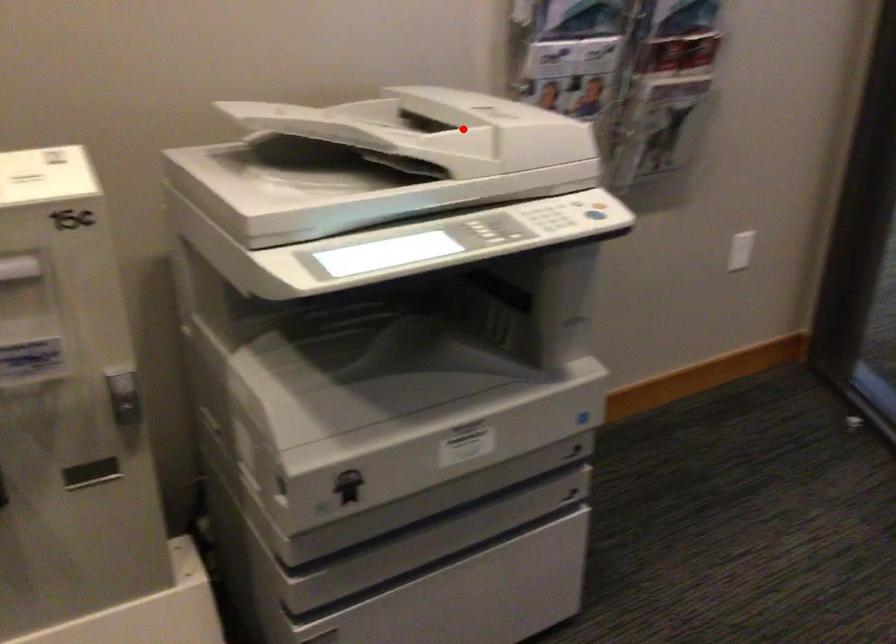
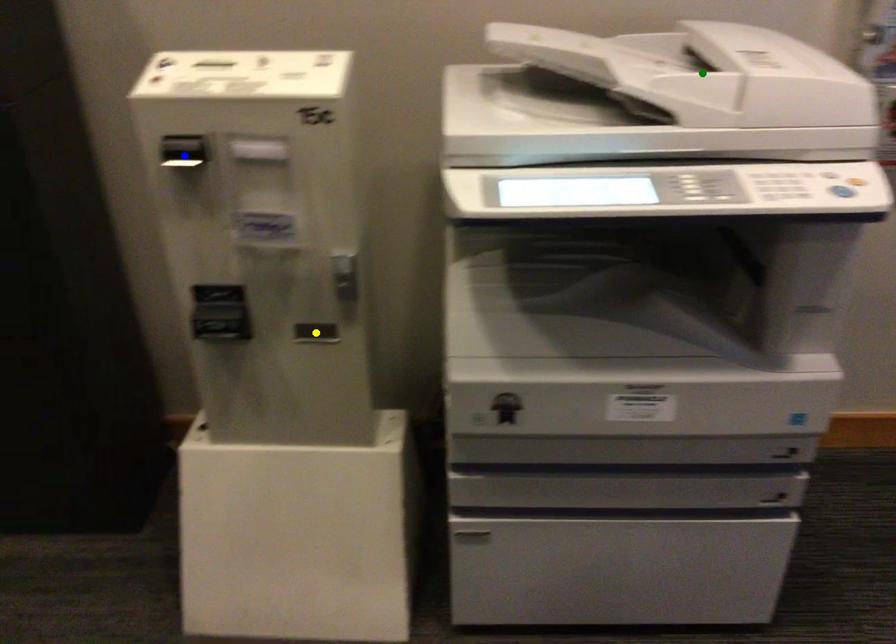
Question: I am providing you with two images of the same scene from different viewpoints. A red point is marked on the first image. You are given multiple points on the second image. Which spot in image 2 lines up with the point in image 1?

Choices:
 (A) yellow point
 (B) blue point
 (C) green point

Answer: (C)